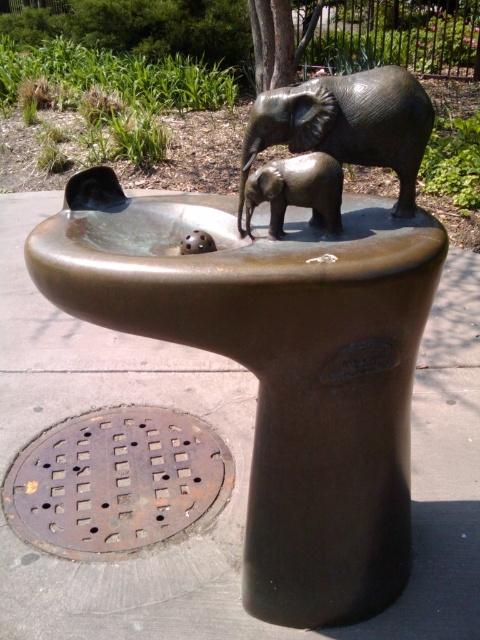
Does bronze/textured elephant at upper center have a larger size compared to rusty metal manhole cover at lower left?

Correct, bronze/textured elephant at upper center is larger in size than rusty metal manhole cover at lower left.

You are a GUI agent. You are given a task and a screenshot of the screen. Output one action in this format:
    pyautogui.click(x=<x>, y=<y>)
    Task: Click on the bronze/textured elephant at upper center
    This screenshot has height=640, width=480.
    Given the screenshot: What is the action you would take?
    pyautogui.click(x=276, y=368)

Between point (323, 241) and point (84, 420), which one is positioned behind?

The point (84, 420) is more distant.

The height and width of the screenshot is (640, 480). What are the coordinates of `bronze/textured elephant at upper center` in the screenshot? It's located at (276, 368).

Which is behind, point (51, 445) or point (285, 109)?

The point (51, 445) is behind.

This screenshot has height=640, width=480. What do you see at coordinates (116, 481) in the screenshot? I see `rusty metal manhole cover at lower left` at bounding box center [116, 481].

Identify the location of rusty metal manhole cover at lower left. The image size is (480, 640). (116, 481).

Does rusty metal manhole cover at lower left have a lesser height compared to bronze baby elephant at center?

No.

Who is more forward, (41, 461) or (244, 214)?

Point (244, 214)

Which is behind, point (172, 515) or point (285, 204)?

The point (172, 515) is more distant.

At what (x,y) coordinates should I click in order to perform the action: click on rusty metal manhole cover at lower left. Please return your answer as a coordinate pair (x, y). Looking at the image, I should click on (116, 481).